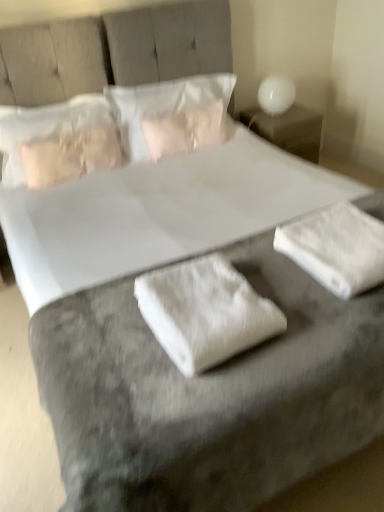
Question: Is white glossy nightstand at upper right wider or thinner than white fluffy towel at lower right, positioned as the first material in right-to-left order?

Choices:
 (A) wide
 (B) thin

Answer: (A)

Question: Does point (249, 113) appear closer or farther from the camera than point (312, 224)?

Choices:
 (A) closer
 (B) farther

Answer: (B)

Question: Estimate the real-world distances between objects in this image. Which object is farther from the white soft pillow at center, which appears as the second pillow when viewed from the left?

Choices:
 (A) white glossy table lamp at upper right
 (B) white fluffy towel at lower right, arranged as the second material when viewed from the left
 (C) white fabric at center, positioned as the first material in left-to-right order
 (D) satin beige pillow at upper left, the first pillow viewed from the left
 (E) white glossy nightstand at upper right

Answer: (C)

Question: Based on their relative distances, which object is farther from the white fabric at center, positioned as the first material in left-to-right order?

Choices:
 (A) white fluffy towel at lower right, positioned as the first material in right-to-left order
 (B) white glossy table lamp at upper right
 (C) white glossy nightstand at upper right
 (D) white soft pillow at center, the first pillow from the right
 (E) satin beige pillow at upper left, the first pillow viewed from the left

Answer: (B)